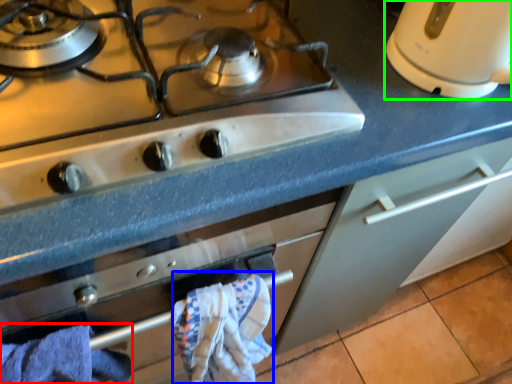
Question: Considering the real-world distances, which object is farthest from bath towel (highlighted by a red box)? bath towel (highlighted by a blue box) or kitchen appliance (highlighted by a green box)?

Choices:
 (A) bath towel
 (B) kitchen appliance

Answer: (B)